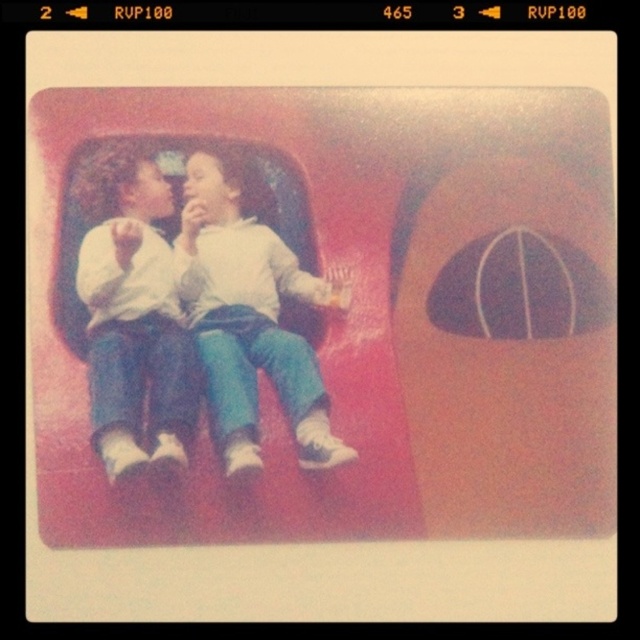
Is matte white hoodie at center closer to camera compared to white cotton shirt at center?

No, it is behind white cotton shirt at center.

Is matte white hoodie at center above white cotton shirt at center?

Yes.

Locate an element on the screen. matte white hoodie at center is located at coordinates (250, 314).

Where is `matte white hoodie at center`? matte white hoodie at center is located at coordinates (250, 314).